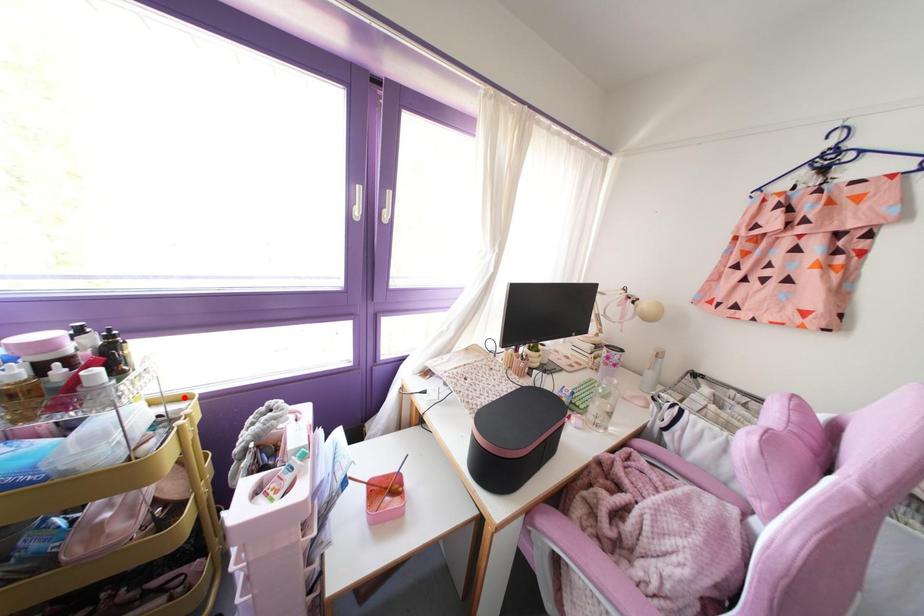
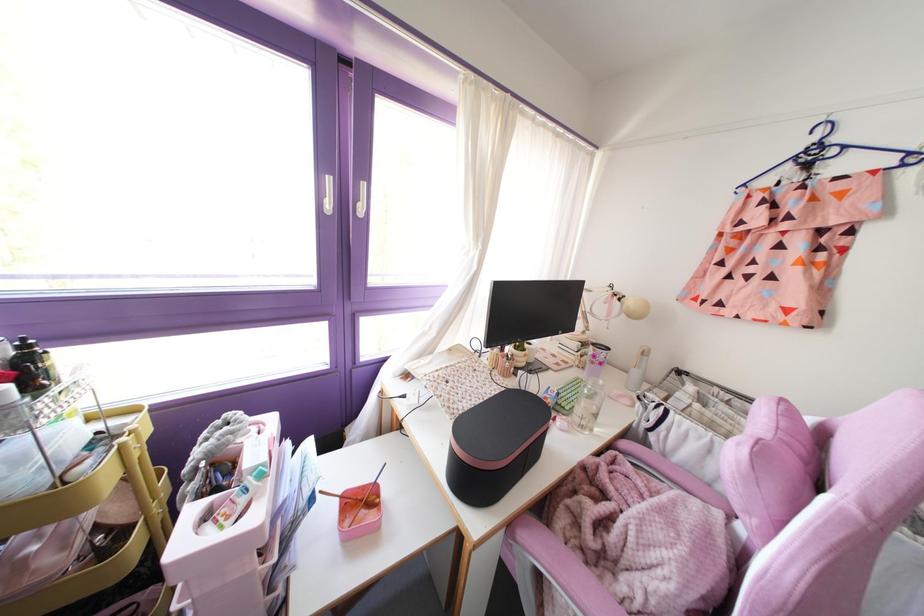
Find the pixel in the second image that matches the highlighted location in the first image.

(130, 411)